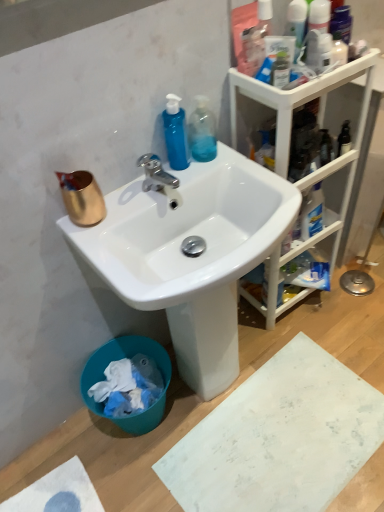
This screenshot has height=512, width=384. What are the coordinates of `free spot to the right of white plastic cabinet at upper right` in the screenshot? It's located at (350, 312).